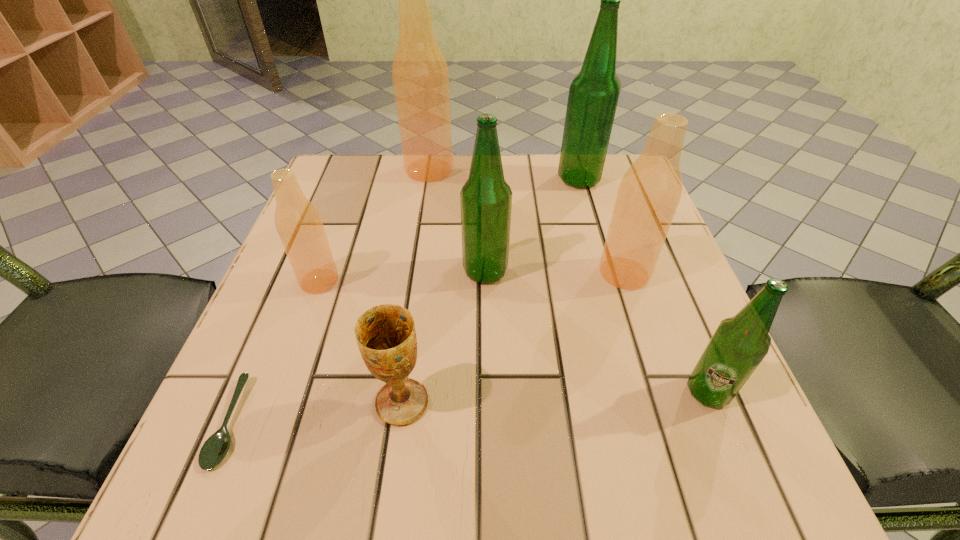
Find the location of a particular element. The height and width of the screenshot is (540, 960). empty space between the farthest green beer bottle and the seventh tallest object is located at coordinates (491, 291).

This screenshot has height=540, width=960. What are the coordinates of `vacant area between the soupspoon and the rightmost tan beer bottle` in the screenshot? It's located at (427, 347).

Where is `free space between the smallest tan beer bottle and the second smallest green beer bottle`? free space between the smallest tan beer bottle and the second smallest green beer bottle is located at coordinates (402, 276).

Locate an element on the screen. The height and width of the screenshot is (540, 960). free spot between the second green beer bottle from right to left and the leftmost beer bottle is located at coordinates (449, 230).

Identify which object is the nearest to the second smallest green beer bottle. Please provide its 2D coordinates. Your answer should be formatted as a tuple, i.e. [(x, y)], where the tuple contains the x and y coordinates of a point satisfying the conditions above.

[(649, 193)]

The image size is (960, 540). I want to click on the third closest object relative to the smallest green beer bottle, so click(386, 336).

Identify which beer bottle is the fifth nearest to the second shortest object. Please provide its 2D coordinates. Your answer should be formatted as a tuple, i.e. [(x, y)], where the tuple contains the x and y coordinates of a point satisfying the conditions above.

[(420, 75)]

I want to click on beer bottle that is the fifth closest to the leftmost green beer bottle, so click(x=739, y=344).

Locate which green beer bottle ranks in proximity to the soupspoon. Please provide its 2D coordinates. Your answer should be formatted as a tuple, i.e. [(x, y)], where the tuple contains the x and y coordinates of a point satisfying the conditions above.

[(486, 198)]

Locate which green beer bottle is the second closest to the seventh tallest object. Please provide its 2D coordinates. Your answer should be formatted as a tuple, i.e. [(x, y)], where the tuple contains the x and y coordinates of a point satisfying the conditions above.

[(739, 344)]